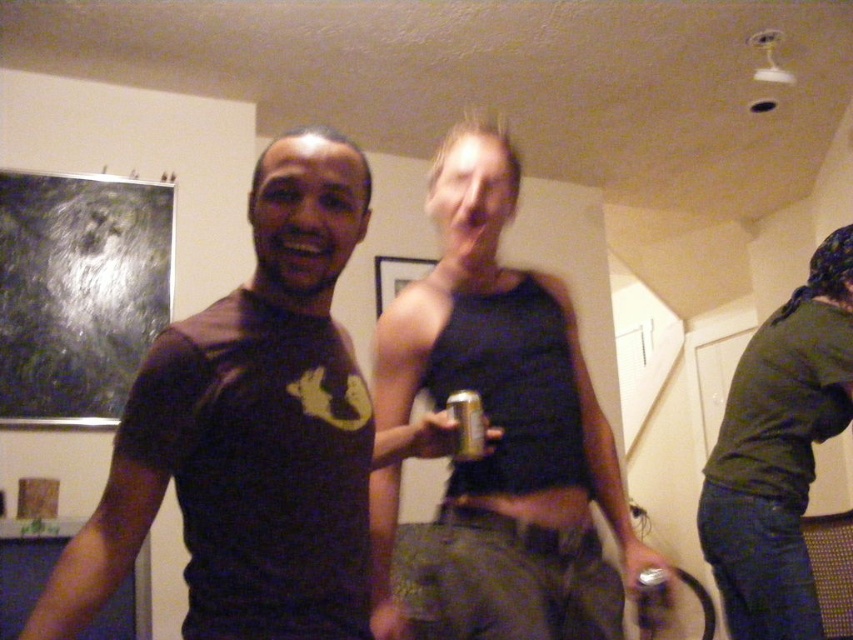
Question: Which point appears farthest from the camera in this image?

Choices:
 (A) (544, 337)
 (B) (369, 456)

Answer: (A)

Question: Does matte black t-shirt at center have a greater width compared to green matte shirt at right?

Choices:
 (A) yes
 (B) no

Answer: (B)

Question: Which point is farther to the camera?

Choices:
 (A) (479, 452)
 (B) (717, 515)
 (C) (288, 476)

Answer: (B)

Question: Can you confirm if metallic can at center is positioned below green matte shirt at right?

Choices:
 (A) yes
 (B) no

Answer: (B)

Question: Considering the real-world distances, which object is farthest from the green matte shirt at right?

Choices:
 (A) metallic silver can at center
 (B) metallic can at center
 (C) matte black t-shirt at center

Answer: (C)

Question: Can you confirm if metallic can at center is thinner than metallic silver can at center?

Choices:
 (A) yes
 (B) no

Answer: (B)